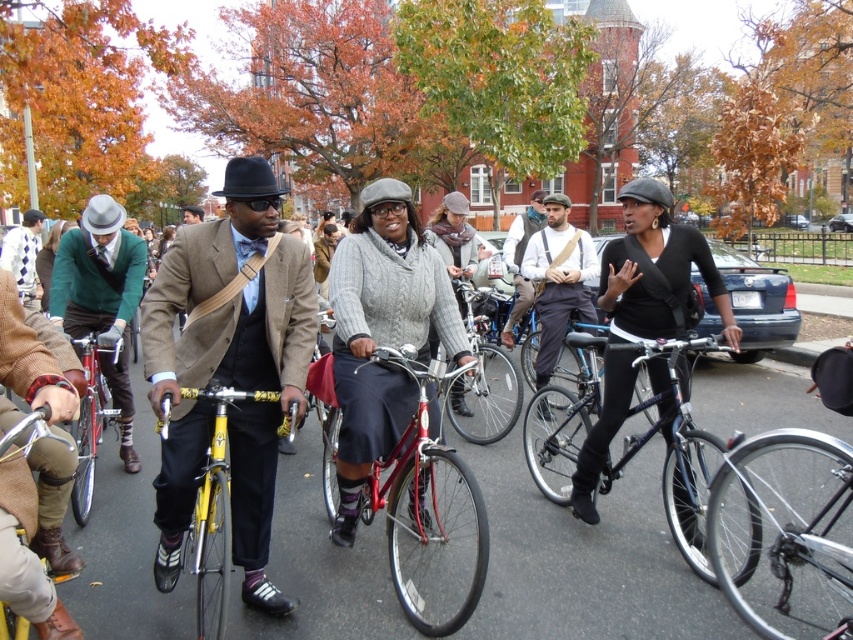
Who is higher up, knitted sweater at center or matte gray bicycle helmet at upper right?

matte gray bicycle helmet at upper right

Does knitted sweater at center have a greater height compared to matte gray bicycle helmet at upper right?

No.

Where is `knitted sweater at center`? This screenshot has width=853, height=640. knitted sweater at center is located at coordinates (381, 333).

Does knitted sweater at center appear under shiny red bicycle at center?

No.

Between knitted sweater at center and shiny red bicycle at center, which one has more height?

With more height is knitted sweater at center.

Locate an element on the screen. The height and width of the screenshot is (640, 853). knitted sweater at center is located at coordinates (381, 333).

Does matte white shirt at center have a greater height compared to matte gray bicycle helmet at upper right?

No.

In the scene shown: Who is shorter, matte white shirt at center or matte gray bicycle helmet at upper right?

With less height is matte white shirt at center.

Is point (582, 284) closer to camera compared to point (630, 186)?

No, it is not.

You are a GUI agent. You are given a task and a screenshot of the screen. Output one action in this format:
    pyautogui.click(x=<x>, y=<y>)
    Task: Click on the matte white shirt at center
    The width and height of the screenshot is (853, 640).
    Given the screenshot: What is the action you would take?
    pyautogui.click(x=558, y=280)